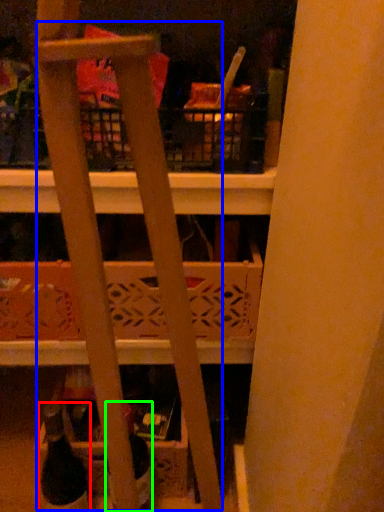
Question: Estimate the real-world distances between objects in this image. Which object is closer to wine bottle (highlighted by a red box), ladder (highlighted by a blue box) or bottle (highlighted by a green box)?

Choices:
 (A) ladder
 (B) bottle

Answer: (B)